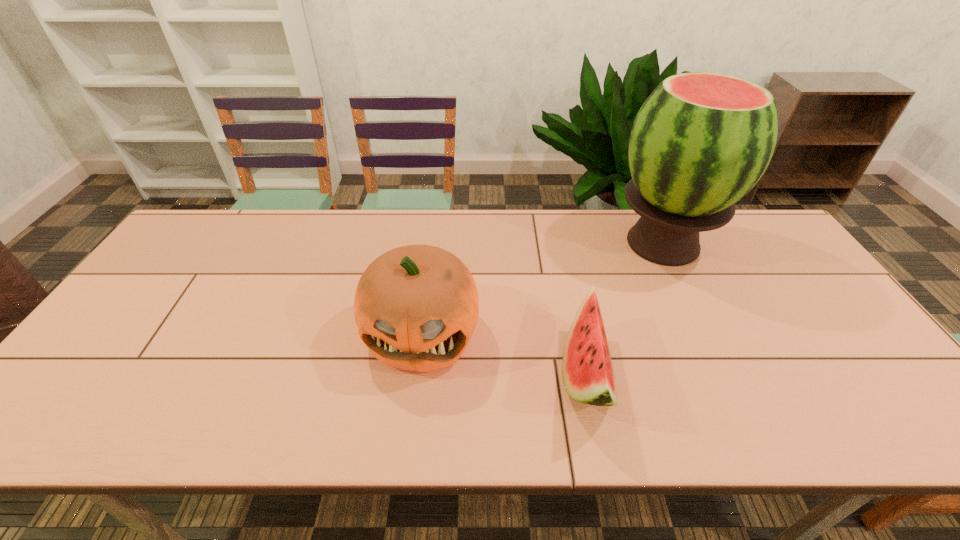
Locate an element on the screen. The width and height of the screenshot is (960, 540). the farthest object is located at coordinates (701, 141).

Identify the location of the rightmost object. The height and width of the screenshot is (540, 960). (701, 141).

At what (x,y) coordinates should I click in order to perform the action: click on the leftmost object. Please return your answer as a coordinate pair (x, y). This screenshot has height=540, width=960. Looking at the image, I should click on (416, 307).

Find the location of a particular element. The height and width of the screenshot is (540, 960). pumpkin is located at coordinates (416, 307).

Find the location of a particular element. the second object from left to right is located at coordinates (588, 377).

What are the coordinates of `the shortest object` in the screenshot? It's located at [588, 377].

The width and height of the screenshot is (960, 540). Find the location of `free space located 0.170m on the left of the right watermelon`. free space located 0.170m on the left of the right watermelon is located at coordinates (554, 244).

The image size is (960, 540). I want to click on vacant space situated on the face of the second shortest object, so click(413, 401).

Find the location of a particular element. The width and height of the screenshot is (960, 540). free space located 0.330m on the outer rind of the left watermelon is located at coordinates (420, 373).

Identify the location of vacant space located on the outer rind of the left watermelon. (411, 373).